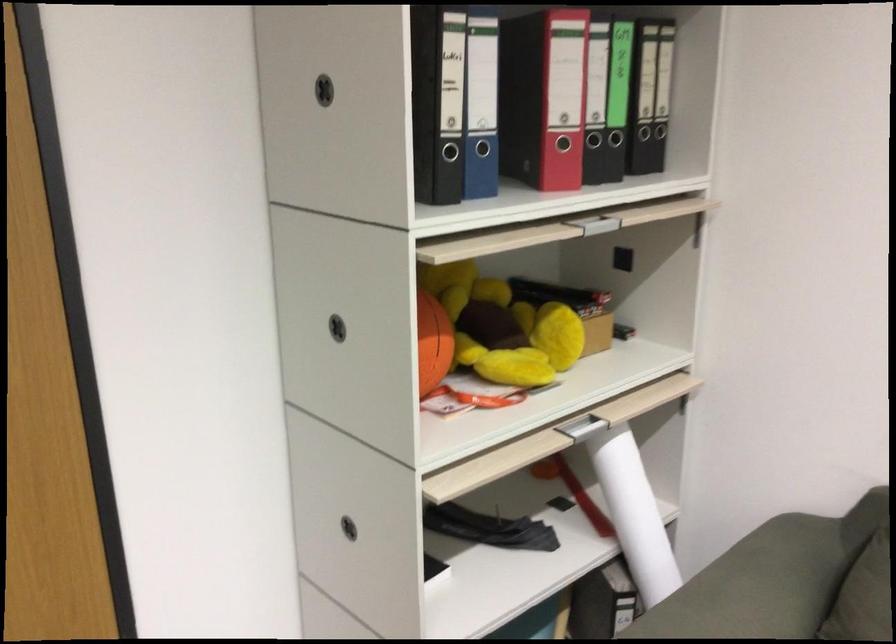
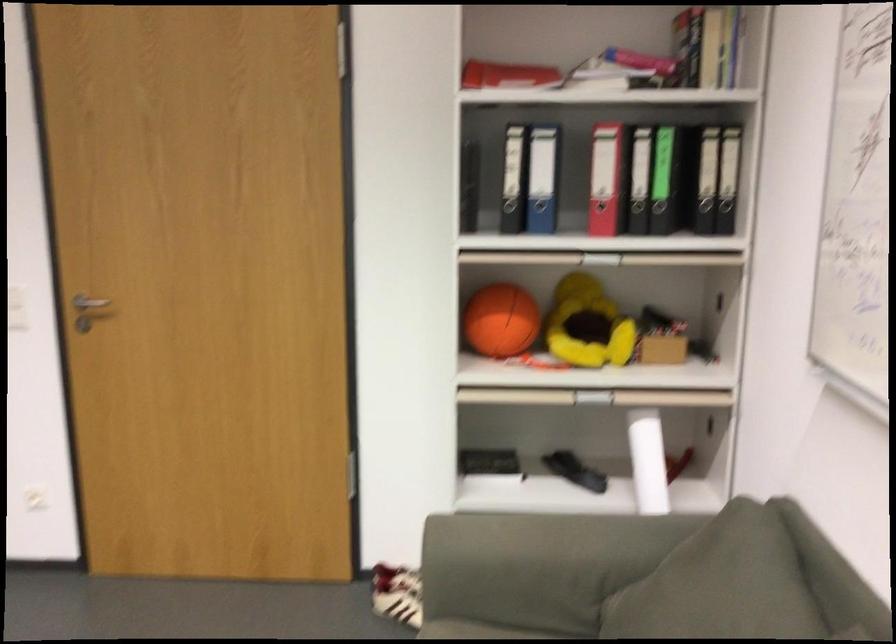
Locate, in the second image, the point that corresponds to pixel 386 567 in the first image.

(489, 464)